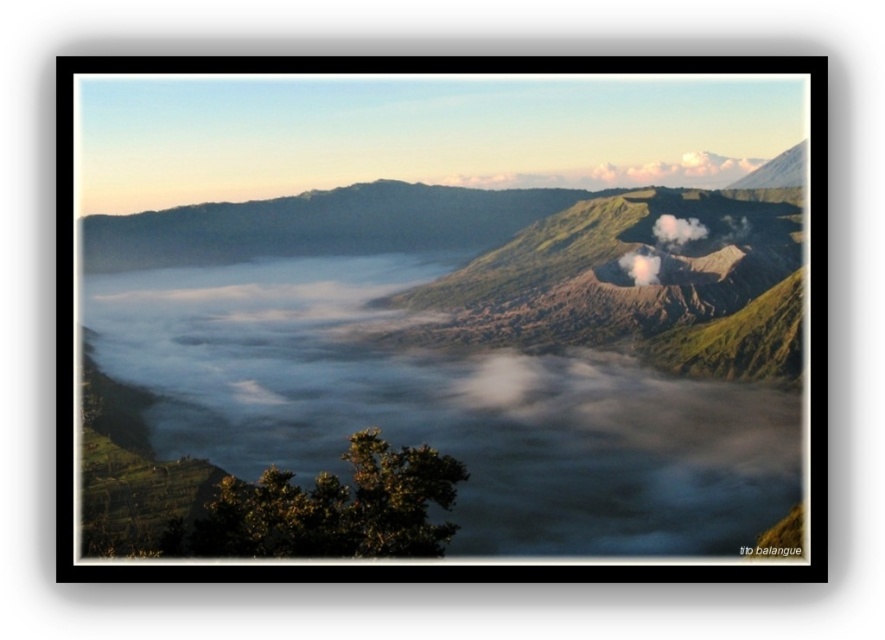
Can you confirm if white fluffy cloud at upper right is positioned to the right of white smoke at upper right?

Indeed, white fluffy cloud at upper right is positioned on the right side of white smoke at upper right.

Between point (737, 176) and point (683, 218), which one is positioned in front?

Point (683, 218) is in front.

I want to click on white fluffy cloud at upper right, so click(678, 170).

Can you confirm if white smoke at upper right is positioned to the left of white smoke at center?

Incorrect, white smoke at upper right is not on the left side of white smoke at center.

Who is more distant from viewer, (699, 237) or (641, 259)?

The point (699, 237) is behind.

Does point (663, 236) lie behind point (636, 262)?

Yes, point (663, 236) is behind point (636, 262).

Image resolution: width=885 pixels, height=640 pixels. What are the coordinates of `white smoke at upper right` in the screenshot? It's located at (676, 230).

Does white fluffy cloud at upper center have a greater height compared to white smoke at center?

Yes.

Does white fluffy cloud at upper center have a smaller size compared to white smoke at center?

No.

This screenshot has height=640, width=885. Find the location of `white fluffy cloud at upper center`. white fluffy cloud at upper center is located at coordinates (622, 173).